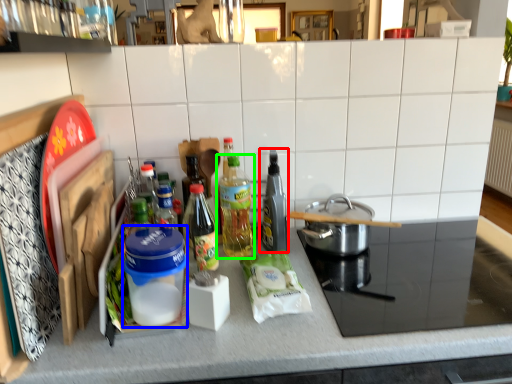
Question: Based on their relative distances, which object is nearer to bottle (highlighted by a red box)? Choose from appliance (highlighted by a blue box) and bottle (highlighted by a green box).

Choices:
 (A) appliance
 (B) bottle

Answer: (B)